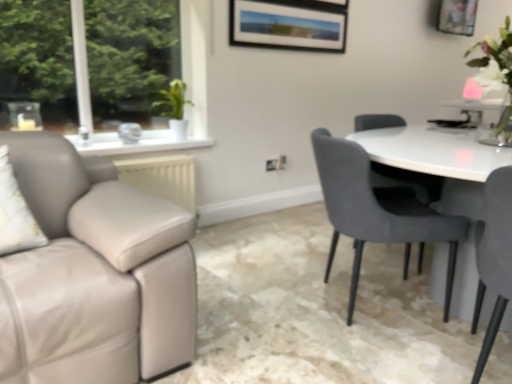
Find the location of `vacant area to the left of matte gray chair at right, which is the first chair from front to back`. vacant area to the left of matte gray chair at right, which is the first chair from front to back is located at coordinates (380, 360).